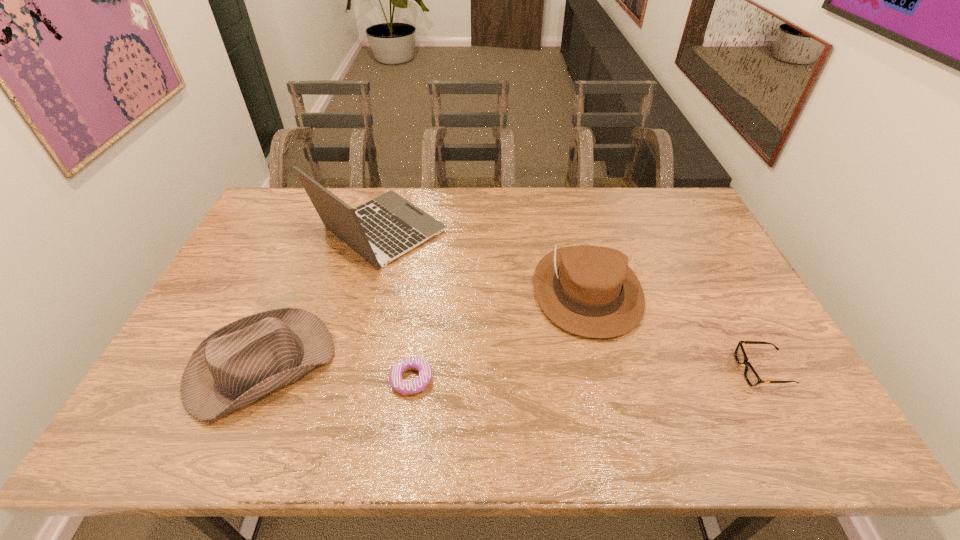
You are a GUI agent. You are given a task and a screenshot of the screen. Output one action in this format:
    pyautogui.click(x=<x>, y=<y>)
    Task: Click on the free location located on the front-facing side of the sunglasses
    This screenshot has height=540, width=960.
    Given the screenshot: What is the action you would take?
    pyautogui.click(x=655, y=370)

Identify the location of vacant space located 0.300m on the front-facing side of the sunglasses. 618,370.

I want to click on free region located 0.220m on the front-facing side of the sunglasses, so click(651, 370).

Find the location of `free space located 0.360m on the back of the doughnut`. free space located 0.360m on the back of the doughnut is located at coordinates (426, 266).

At what (x,y) coordinates should I click in order to perform the action: click on object present at the far edge. Please return your answer as a coordinate pair (x, y). This screenshot has height=540, width=960. Looking at the image, I should click on (389, 226).

Identify the location of object that is at the near edge. The width and height of the screenshot is (960, 540). pyautogui.click(x=239, y=363).

You are a GUI agent. You are given a task and a screenshot of the screen. Output one action in this format:
    pyautogui.click(x=<x>, y=<y>)
    Task: Click on the object that is positioned at the left edge
    Image resolution: width=960 pixels, height=540 pixels.
    Given the screenshot: What is the action you would take?
    pyautogui.click(x=239, y=363)

This screenshot has height=540, width=960. Identify the location of object present at the right edge. (751, 376).

Locate an element on the screen. object located in the near left corner section of the desktop is located at coordinates (239, 363).

At what (x,y) coordinates should I click in order to perform the action: click on free space at the far edge of the desktop. Please return your answer as a coordinate pair (x, y). Image resolution: width=960 pixels, height=540 pixels. Looking at the image, I should click on (444, 200).